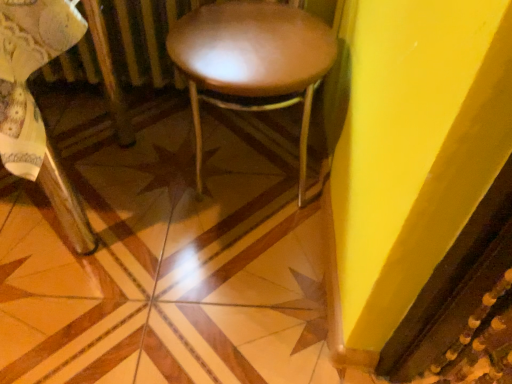
Where is `free location in front of leather-like brown stool at center`? This screenshot has height=384, width=512. free location in front of leather-like brown stool at center is located at coordinates (229, 281).